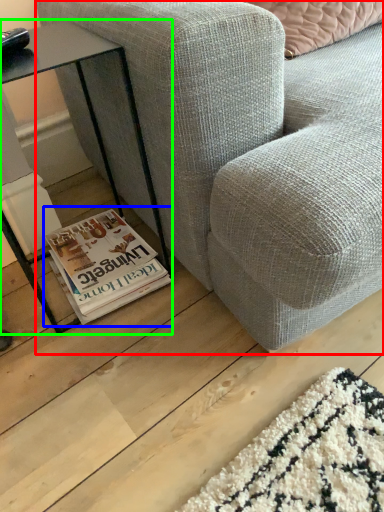
Question: Which object is the closest to the studio couch (highlighted by a red box)? Choose among these: paperback book (highlighted by a blue box) or table (highlighted by a green box).

Choices:
 (A) paperback book
 (B) table

Answer: (B)